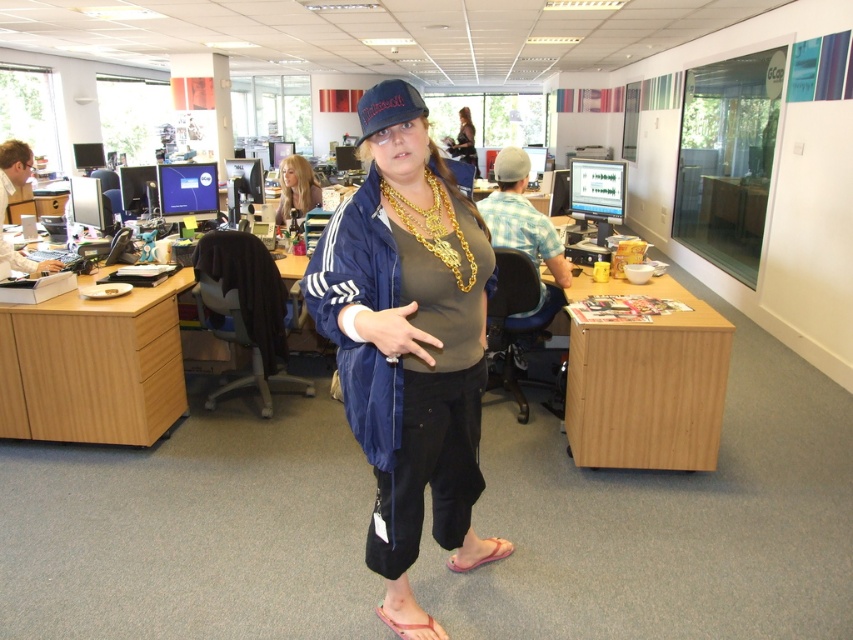
Which is below, blue fabric baseball cap at center or matte black dress at center?

blue fabric baseball cap at center is below.

Does blue fabric baseball cap at center have a greater width compared to matte black dress at center?

No.

Does point (368, 90) come behind point (469, 160)?

No, (368, 90) is closer to viewer.

Find the location of a particular element. blue fabric baseball cap at center is located at coordinates (387, 106).

Between gray fabric baseball cap at center and pink rubber sandal at lower center, which one is positioned lower?

pink rubber sandal at lower center is below.

Which is behind, point (502, 166) or point (494, 547)?

The point (502, 166) is behind.

Is point (509, 180) positioned after point (454, 556)?

Yes, point (509, 180) is behind point (454, 556).

Locate an element on the screen. The height and width of the screenshot is (640, 853). gray fabric baseball cap at center is located at coordinates (511, 164).

Is blonde hair at upper center shorter than pink fabric sandal at lower center?

No, blonde hair at upper center is not shorter than pink fabric sandal at lower center.

In the scene shown: Which of these two, blonde hair at upper center or pink fabric sandal at lower center, stands taller?

With more height is blonde hair at upper center.

Which is in front, point (312, 186) or point (430, 621)?

Point (430, 621) is more forward.

Identify the location of blonde hair at upper center. This screenshot has width=853, height=640. (296, 188).